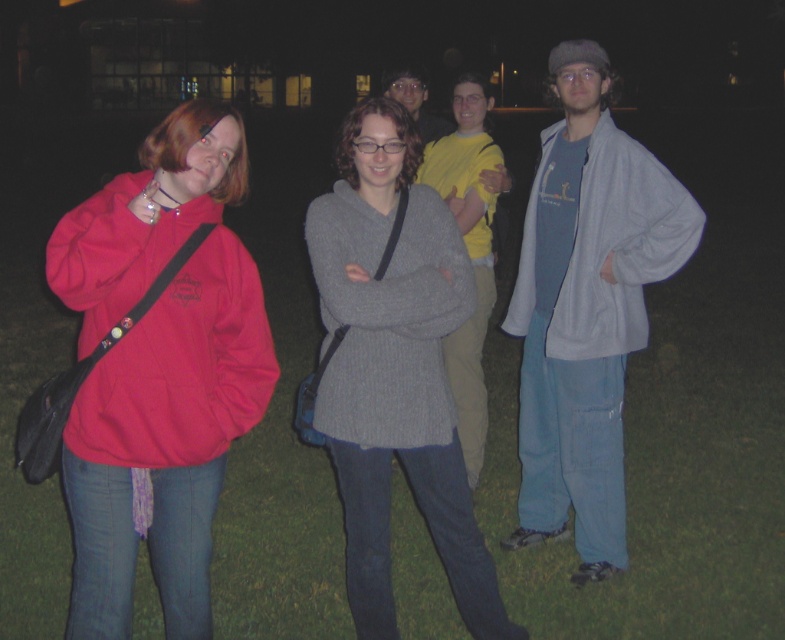
Is yellow cotton shirt at center thinner than matte gray sweater at center?

Yes, yellow cotton shirt at center is thinner than matte gray sweater at center.

Does point (462, 408) come behind point (411, 96)?

No, it is in front of (411, 96).

This screenshot has width=785, height=640. I want to click on yellow cotton shirt at center, so point(466,252).

Is the position of knitted gray sweater at center more distant than that of light blue fleece jacket at right?

No.

Image resolution: width=785 pixels, height=640 pixels. Identify the location of knitted gray sweater at center. (393, 368).

Is knitted gray sweater at center behind matte gray sweater at center?

No.

The image size is (785, 640). What do you see at coordinates (393, 368) in the screenshot? I see `knitted gray sweater at center` at bounding box center [393, 368].

Where is `knitted gray sweater at center`? This screenshot has height=640, width=785. knitted gray sweater at center is located at coordinates (393, 368).